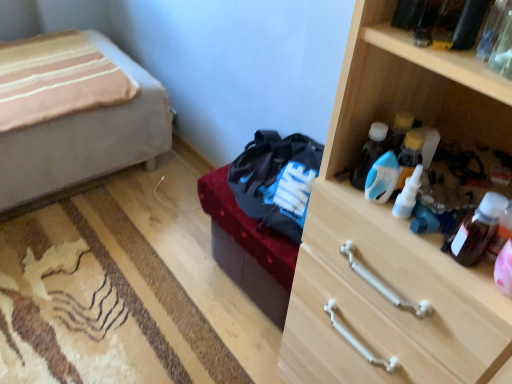
Question: Would you say white plastic bottle at upper right, which ranks as the fourth bottle in left-to-right order, is outside dark brown leather bed frame at center?

Choices:
 (A) yes
 (B) no

Answer: (A)

Question: Is white plastic bottle at upper right, positioned as the second bottle in right-to-left order, looking in the opposite direction of dark brown leather bed frame at center?

Choices:
 (A) yes
 (B) no

Answer: (B)

Question: From a real-world perspective, does white plastic bottle at upper right, positioned as the second bottle in right-to-left order, stand above dark brown leather bed frame at center?

Choices:
 (A) no
 (B) yes

Answer: (B)

Question: Are white plastic bottle at upper right, positioned as the second bottle in right-to-left order, and dark brown leather bed frame at center located far from each other?

Choices:
 (A) no
 (B) yes

Answer: (A)

Question: From a real-world perspective, is white plastic bottle at upper right, positioned as the second bottle in right-to-left order, positioned under dark brown leather bed frame at center based on gravity?

Choices:
 (A) no
 (B) yes

Answer: (A)

Question: Looking at their shapes, would you say translucent plastic bottle at upper right, which is the 3th bottle in right-to-left order, is wider or thinner than dark brown leather bed frame at center?

Choices:
 (A) wide
 (B) thin

Answer: (B)

Question: Considering the positions of point (414, 190) and point (259, 268), is point (414, 190) closer or farther from the camera than point (259, 268)?

Choices:
 (A) farther
 (B) closer

Answer: (B)

Question: Considering the positions of translucent plastic bottle at upper right, which is the 3th bottle in left-to-right order, and dark brown leather bed frame at center in the image, is translucent plastic bottle at upper right, which is the 3th bottle in left-to-right order, bigger or smaller than dark brown leather bed frame at center?

Choices:
 (A) small
 (B) big

Answer: (A)

Question: From the image's perspective, is translucent plastic bottle at upper right, which is the 3th bottle in right-to-left order, located above or below dark brown leather bed frame at center?

Choices:
 (A) above
 (B) below

Answer: (A)

Question: Do you think white plastic bottle at upper right, positioned as the second bottle in right-to-left order, is within blue plastic bottle at center right, placed as the 4th bottle when sorted from right to left, or outside of it?

Choices:
 (A) inside
 (B) outside

Answer: (B)

Question: From the image's perspective, is white plastic bottle at upper right, which ranks as the fourth bottle in left-to-right order, positioned above or below blue plastic bottle at center right, the second bottle in the left-to-right sequence?

Choices:
 (A) above
 (B) below

Answer: (A)

Question: Is white plastic bottle at upper right, which ranks as the fourth bottle in left-to-right order, taller or shorter than blue plastic bottle at center right, the second bottle in the left-to-right sequence?

Choices:
 (A) short
 (B) tall

Answer: (B)

Question: In the image, is white plastic bottle at upper right, positioned as the second bottle in right-to-left order, on the left side or the right side of blue plastic bottle at center right, the second bottle in the left-to-right sequence?

Choices:
 (A) left
 (B) right

Answer: (B)

Question: Is point (374, 196) closer or farther from the camera than point (394, 203)?

Choices:
 (A) farther
 (B) closer

Answer: (A)

Question: In the image, is blue plastic bottle at center right, the second bottle in the left-to-right sequence, positioned in front of or behind translucent plastic bottle at upper right, which is the 3th bottle in right-to-left order?

Choices:
 (A) behind
 (B) front

Answer: (A)